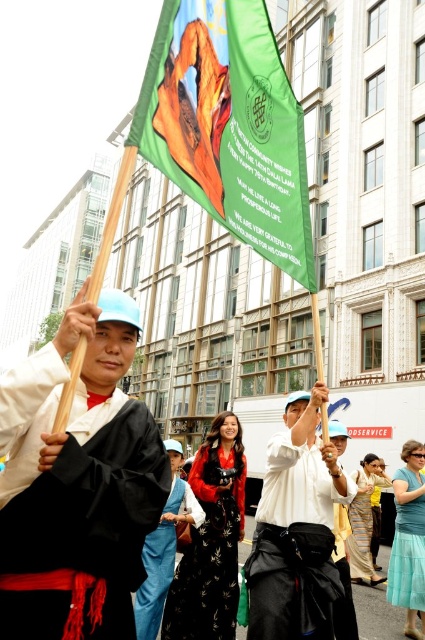
Question: Where is white cotton shirt at center located in relation to teal satin dress at lower right in the image?

Choices:
 (A) above
 (B) below

Answer: (A)

Question: Considering the real-world distances, which object is farthest from the teal satin dress at lower right?

Choices:
 (A) white cotton shirt at center
 (B) green fabric flag at upper center

Answer: (B)

Question: Considering the real-world distances, which object is farthest from the teal satin dress at lower right?

Choices:
 (A) striped cotton dress at lower right
 (B) green fabric flag at upper center
 (C) matte black robe at center

Answer: (B)

Question: Which of the following is the closest to the observer?

Choices:
 (A) striped cotton dress at lower right
 (B) white cotton shirt at center
 (C) teal satin dress at lower right

Answer: (B)

Question: Can you confirm if green fabric flag at upper center is bigger than striped cotton dress at lower right?

Choices:
 (A) no
 (B) yes

Answer: (B)

Question: Does black satin dress at center appear over teal satin dress at lower right?

Choices:
 (A) yes
 (B) no

Answer: (A)